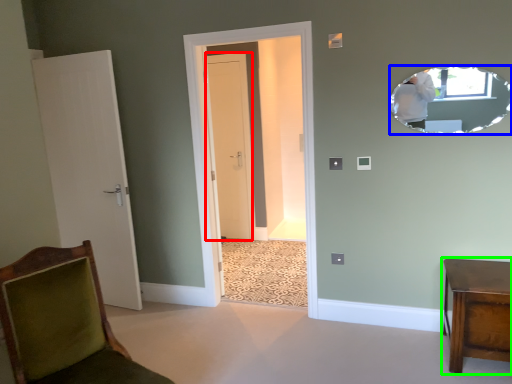
Question: Which object is the closest to the door (highlighted by a red box)? Choose among these: mirror (highlighted by a blue box) or furniture (highlighted by a green box).

Choices:
 (A) mirror
 (B) furniture

Answer: (A)